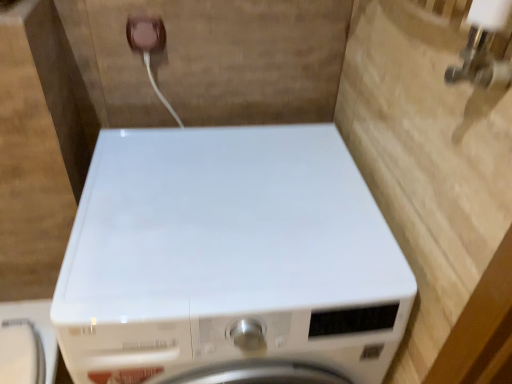
At what (x,y) coordinates should I click in order to perform the action: click on white glossy washing machine at center. Please return your answer as a coordinate pair (x, y). Looking at the image, I should click on (229, 261).

Describe the element at coordinates (229, 261) in the screenshot. The height and width of the screenshot is (384, 512). I see `white glossy washing machine at center` at that location.

At what (x,y) coordinates should I click in order to perform the action: click on white glossy washing machine at center. Please return your answer as a coordinate pair (x, y). The height and width of the screenshot is (384, 512). Looking at the image, I should click on (229, 261).